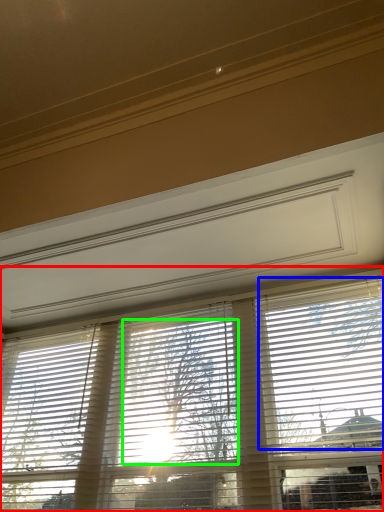
Question: Which object is positioned farthest from window blind (highlighted by a red box)? Select from blind (highlighted by a blue box) and tree (highlighted by a green box).

Choices:
 (A) blind
 (B) tree

Answer: (A)